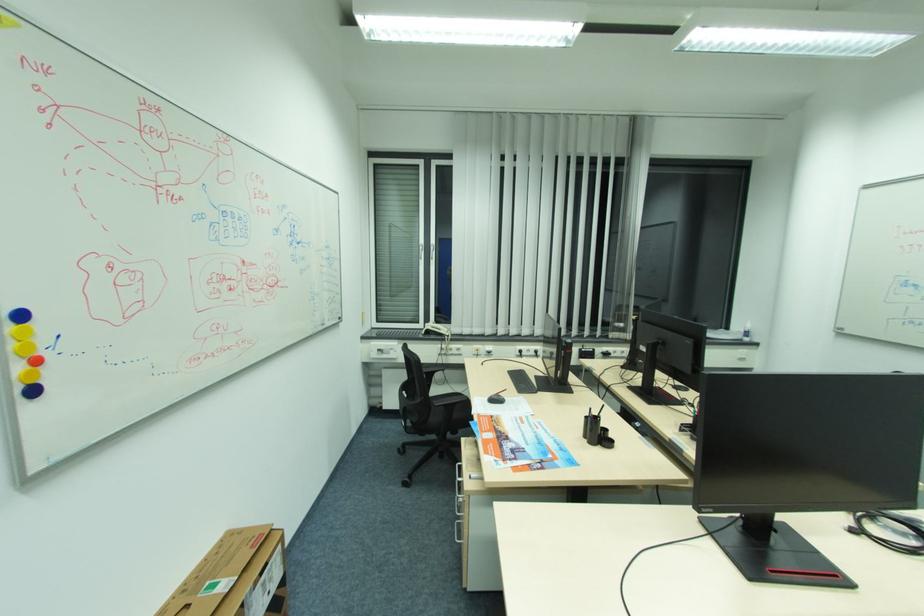
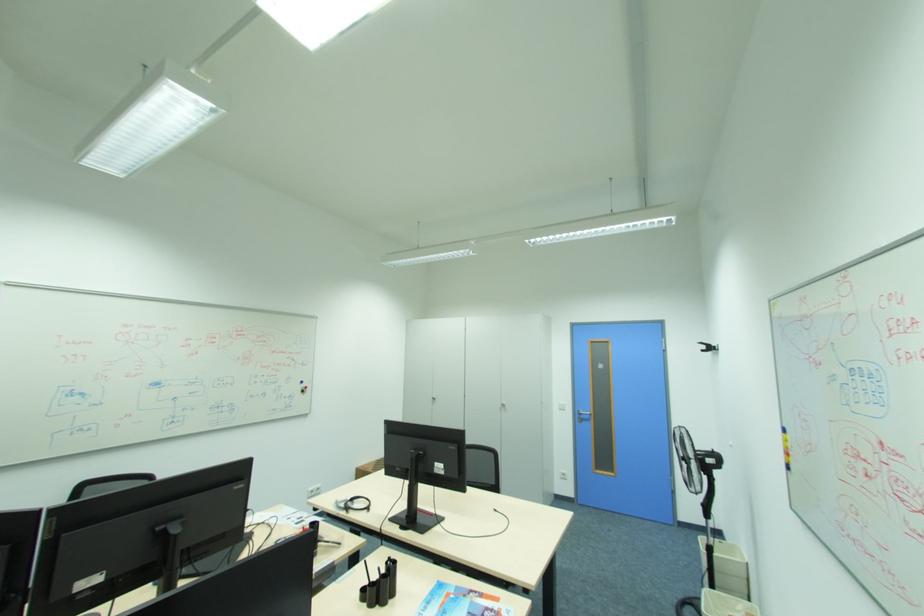
Find the pixel in the second image that matches (x=49, y=342) in the first image.

(794, 446)